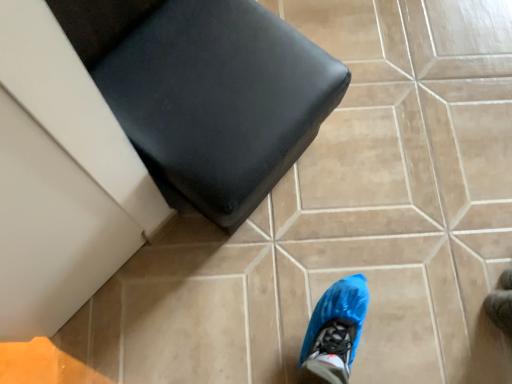
I want to click on free space in front of black leather chair at upper left, so [x=258, y=272].